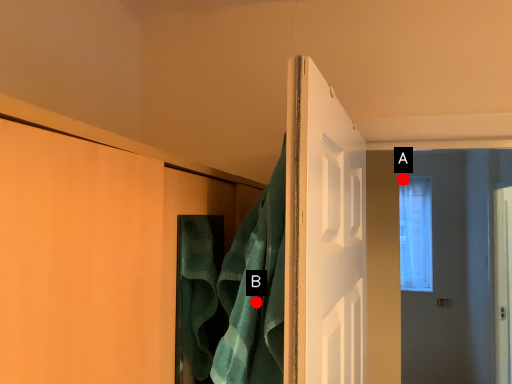
Question: Two points are circled on the image, labeled by A and B beside each circle. Which point is further to the camera?

Choices:
 (A) A is further
 (B) B is further

Answer: (A)